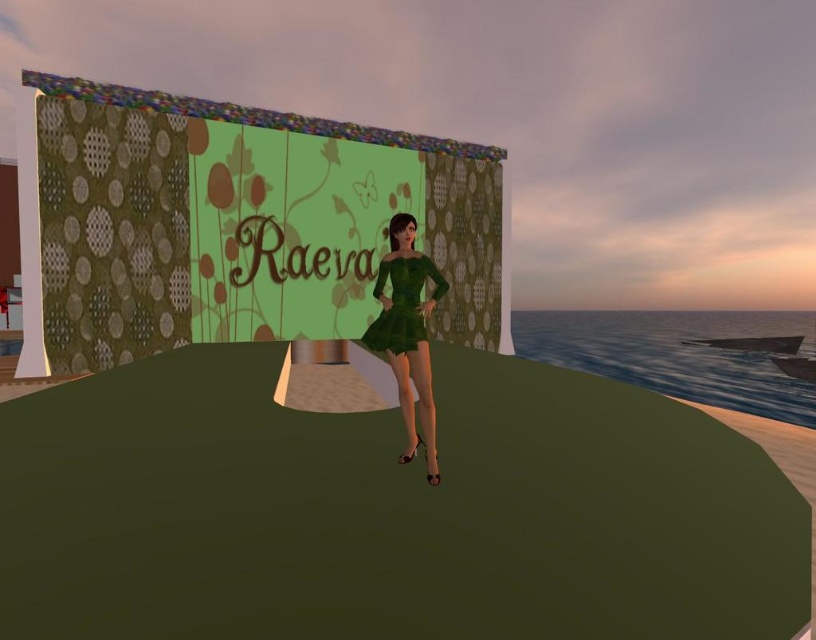
Is green satin dress at center taller than green velvet dress at center?

Yes.

Which of these two, green satin dress at center or green velvet dress at center, stands shorter?

green velvet dress at center is shorter.

Between point (395, 275) and point (435, 300), which one is positioned in front?

Point (435, 300)

You are a GUI agent. You are given a task and a screenshot of the screen. Output one action in this format:
    pyautogui.click(x=<x>, y=<y>)
    Task: Click on the green satin dress at center
    The height and width of the screenshot is (640, 816).
    Given the screenshot: What is the action you would take?
    pyautogui.click(x=408, y=333)